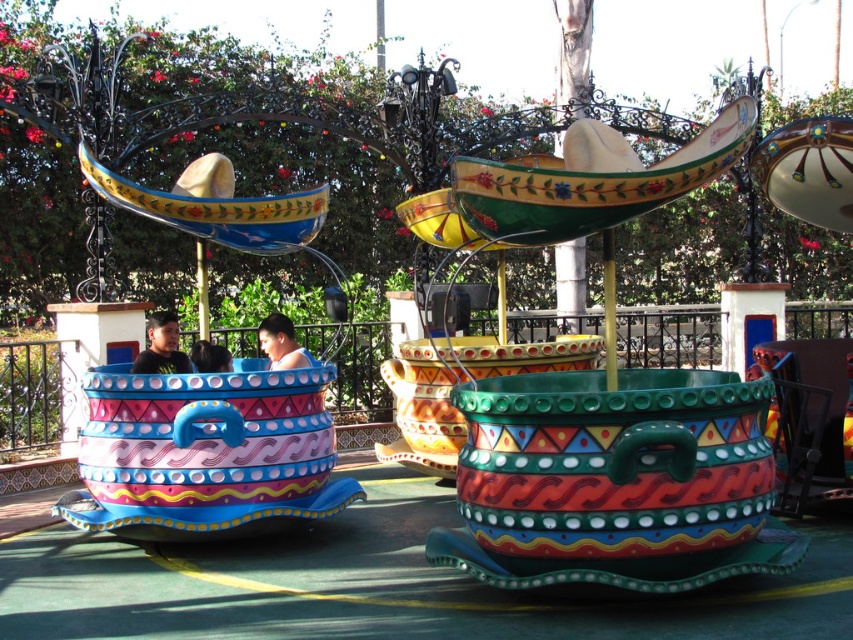
Question: Which point is closer to the camera taking this photo?

Choices:
 (A) (572, 236)
 (B) (132, 371)

Answer: (A)

Question: Estimate the real-world distances between objects in this image. Which object is farther from the smooth blue shirt at center?

Choices:
 (A) matte ceramic teacup at center
 (B) matte black shirt at left

Answer: (A)

Question: Can you confirm if matte black shirt at left is bigger than smooth blue shirt at center?

Choices:
 (A) no
 (B) yes

Answer: (A)

Question: Does matte ceramic teacup at center come in front of matte black shirt at left?

Choices:
 (A) yes
 (B) no

Answer: (A)

Question: Considering the relative positions of matte ceramic teacup at center and matte black shirt at left in the image provided, where is matte ceramic teacup at center located with respect to matte black shirt at left?

Choices:
 (A) below
 (B) above

Answer: (B)

Question: Considering the real-world distances, which object is closest to the matte ceramic teacup at center?

Choices:
 (A) matte black shirt at left
 (B) smooth blue shirt at center

Answer: (B)